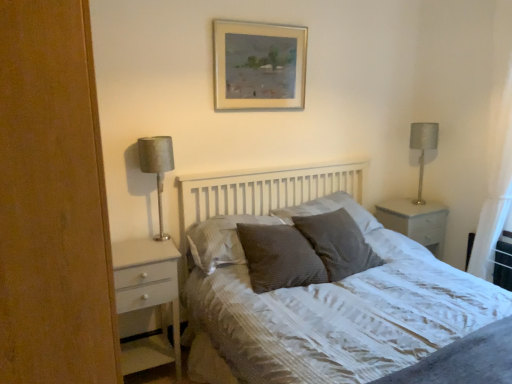
Question: From a real-world perspective, is dark grey textured pillow at center, positioned as the 3th pillow in right-to-left order, positioned over textured gray pillow at center, positioned as the 3th pillow in left-to-right order, based on gravity?

Choices:
 (A) yes
 (B) no

Answer: (B)

Question: Is dark grey textured pillow at center, positioned as the 3th pillow in right-to-left order, further to camera compared to textured gray pillow at center, acting as the second pillow starting from the right?

Choices:
 (A) yes
 (B) no

Answer: (B)

Question: Is dark grey textured pillow at center, positioned as the 3th pillow in right-to-left order, positioned in front of textured gray pillow at center, acting as the second pillow starting from the right?

Choices:
 (A) no
 (B) yes

Answer: (B)

Question: Does dark grey textured pillow at center, positioned as the 3th pillow in right-to-left order, have a greater width compared to textured gray pillow at center, acting as the second pillow starting from the right?

Choices:
 (A) no
 (B) yes

Answer: (A)

Question: Is dark grey textured pillow at center, positioned as the 2th pillow in left-to-right order, not inside textured gray pillow at center, acting as the second pillow starting from the right?

Choices:
 (A) no
 (B) yes

Answer: (B)

Question: Based on their sizes in the image, would you say satin silver lamp at left is bigger or smaller than silver metallic lampshade at right?

Choices:
 (A) small
 (B) big

Answer: (B)

Question: From the image's perspective, is satin silver lamp at left located above or below silver metallic lampshade at right?

Choices:
 (A) below
 (B) above

Answer: (A)

Question: Considering their positions, is satin silver lamp at left located in front of or behind silver metallic lampshade at right?

Choices:
 (A) behind
 (B) front

Answer: (B)

Question: In terms of height, does satin silver lamp at left look taller or shorter compared to silver metallic lampshade at right?

Choices:
 (A) short
 (B) tall

Answer: (B)

Question: Is dark grey textured pillow at center, positioned as the 3th pillow in right-to-left order, wider or thinner than white glossy nightstand at right?

Choices:
 (A) thin
 (B) wide

Answer: (A)

Question: Would you say dark grey textured pillow at center, positioned as the 3th pillow in right-to-left order, is inside or outside white glossy nightstand at right?

Choices:
 (A) inside
 (B) outside

Answer: (B)

Question: Does point (293, 249) appear closer or farther from the camera than point (396, 226)?

Choices:
 (A) farther
 (B) closer

Answer: (B)

Question: Based on their sizes in the image, would you say dark grey textured pillow at center, positioned as the 3th pillow in right-to-left order, is bigger or smaller than white glossy nightstand at right?

Choices:
 (A) big
 (B) small

Answer: (B)

Question: From their relative heights in the image, would you say textured gray pillow at center, the 1th pillow in the right-to-left sequence, is taller or shorter than silver metallic lampshade at right?

Choices:
 (A) tall
 (B) short

Answer: (B)

Question: Is textured gray pillow at center, the 1th pillow in the right-to-left sequence, in front of or behind silver metallic lampshade at right in the image?

Choices:
 (A) front
 (B) behind

Answer: (A)